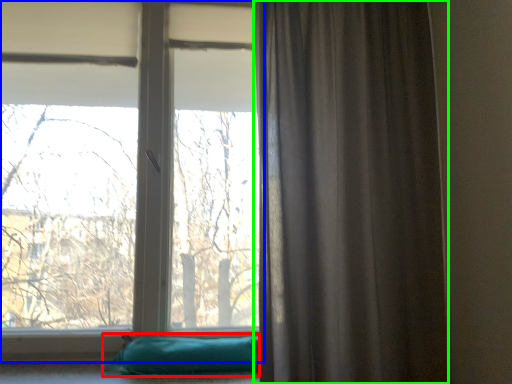
Question: Considering the real-world distances, which object is farthest from pillow (highlighted by a red box)? window (highlighted by a blue box) or curtain (highlighted by a green box)?

Choices:
 (A) window
 (B) curtain

Answer: (A)